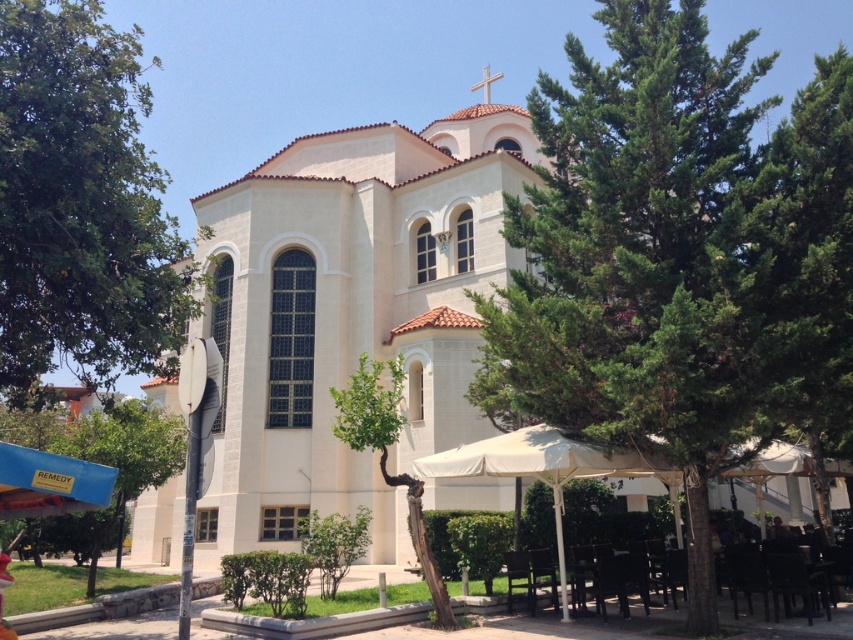
You are a visitor standing in front of the building and see the white fabric umbrella at lower center and the blue fabric canopy at lower left. Which one is more to the right?

The white fabric umbrella at lower center is more to the right because it is positioned on the right side of the blue fabric canopy at lower left.

You are a landscape architect designing a walking path between the green leafy tree at center and the green leafy tree at lower center. What is the minimum width required for the path to ensure it comfortably fits a 1.5 meter wide maintenance vehicle?

The distance between the green leafy tree at center and the green leafy tree at lower center is 9.00 meters. Since the maintenance vehicle is 1.5 meters wide, the path must be at least 1.5 meters wide to accommodate it comfortably.

You are standing in front of the building and notice two green leafy trees. Which tree, the green leafy tree at center or the green leafy tree at lower center, is closer to you?

The green leafy tree at center is closer to you because it is positioned in front of the green leafy tree at lower center.